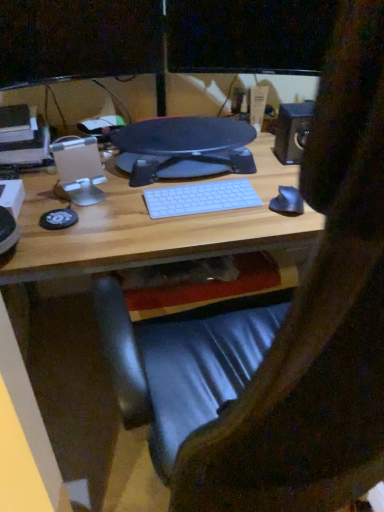
Locate an element on the screen. Image resolution: width=384 pixels, height=512 pixels. free point to the left of white matte keyboard at center is located at coordinates (115, 209).